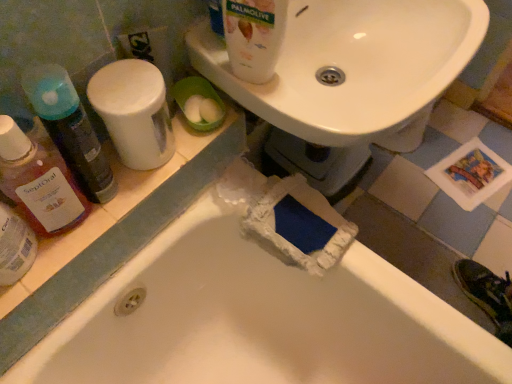
Question: Relative to white plastic container at upper left, which ranks as the third cleaning product in left-to-right order, is translucent plastic mouthwash at left in front or behind?

Choices:
 (A) front
 (B) behind

Answer: (A)

Question: Visually, is translucent plastic mouthwash at left positioned to the left or to the right of white plastic container at upper left, which appears as the second cleaning product when viewed from the right?

Choices:
 (A) left
 (B) right

Answer: (A)

Question: Estimate the real-world distances between objects in this image. Which object is closer to the translucent plastic bottle at left, the fourth cleaning product in the right-to-left sequence?

Choices:
 (A) white glossy bottle at upper center, which is the 4th cleaning product in left-to-right order
 (B) translucent plastic mouthwash at left
 (C) white matte bathtub at lower left
 (D) white plastic container at upper left, which appears as the second cleaning product when viewed from the right
 (E) translucent plastic bottle at left, which ranks as the 3th cleaning product in right-to-left order

Answer: (E)

Question: Which of these objects is positioned closest to the translucent plastic bottle at left, marked as the second cleaning product in a left-to-right arrangement?

Choices:
 (A) white matte bathtub at lower left
 (B) white glossy sink at upper center
 (C) translucent plastic mouthwash at left
 (D) translucent plastic bottle at left, arranged as the 1th cleaning product when viewed from the left
 (E) white plastic container at upper left, which ranks as the third cleaning product in left-to-right order

Answer: (D)